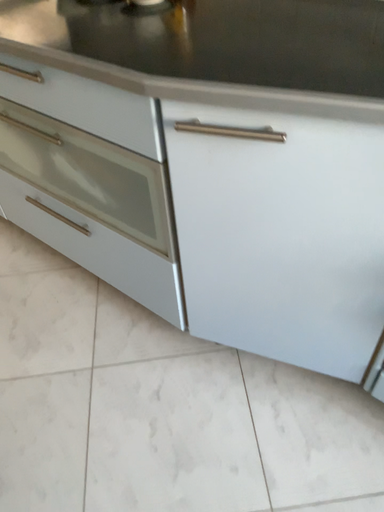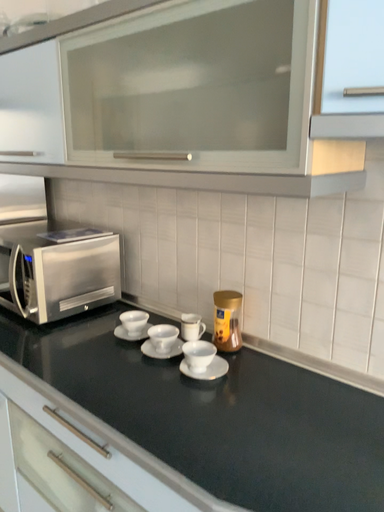
Question: Which way did the camera rotate in the video?

Choices:
 (A) rotated downward
 (B) rotated upward

Answer: (B)